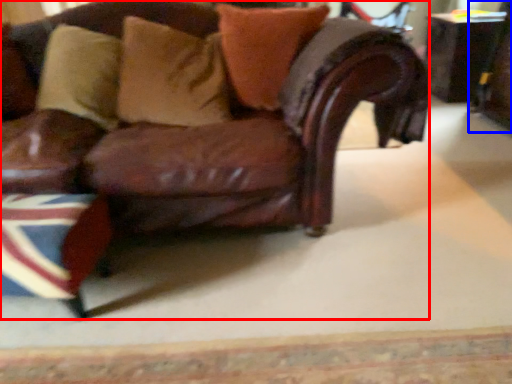
Question: Which of the following is the closest to the observer, chair (highlighted by a red box) or swivel chair (highlighted by a blue box)?

Choices:
 (A) chair
 (B) swivel chair

Answer: (A)